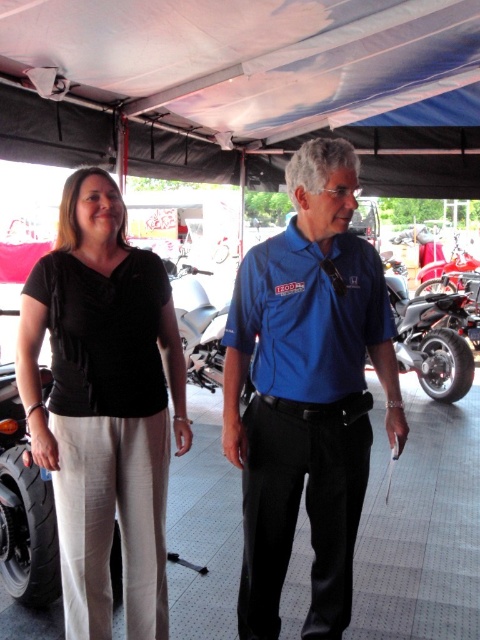
Question: Based on their relative distances, which object is farther from the black matte shirt at center?

Choices:
 (A) blue shirt at center
 (B) black fabric shirt at left
 (C) black rubber tire at lower left

Answer: (C)

Question: Does blue shirt at center have a lesser width compared to black fabric shirt at left?

Choices:
 (A) no
 (B) yes

Answer: (A)

Question: In this image, where is blue shirt at center located relative to black fabric shirt at left?

Choices:
 (A) right
 (B) left

Answer: (A)

Question: Which of the following is the closest to the observer?

Choices:
 (A) (48, 508)
 (B) (339, 518)
 (C) (261, 438)
 (D) (149, 310)

Answer: (B)

Question: Among these points, which one is farthest from the camera?

Choices:
 (A) (14, 550)
 (B) (103, 600)

Answer: (A)

Question: Can you confirm if black matte shirt at center is thinner than black rubber tire at lower left?

Choices:
 (A) no
 (B) yes

Answer: (A)